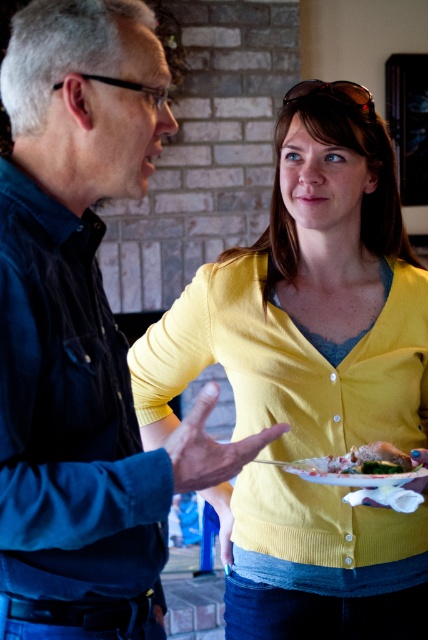
Question: Does matte black shirt at left appear on the right side of shiny silver plate at center?

Choices:
 (A) no
 (B) yes

Answer: (A)

Question: Is yellow knit cardigan at center bigger than shiny silver plate at center?

Choices:
 (A) no
 (B) yes

Answer: (B)

Question: Among these points, which one is nearest to the camera?

Choices:
 (A) (377, 444)
 (B) (3, 262)
 (C) (344, 106)

Answer: (B)

Question: Where is matte black shirt at left located in relation to shiny silver plate at center in the image?

Choices:
 (A) right
 (B) left

Answer: (B)

Question: Which object appears closest to the camera in this image?

Choices:
 (A) yellow knit cardigan at center
 (B) porcelain floral plate at center
 (C) shiny silver plate at center
 (D) matte black shirt at left

Answer: (D)

Question: Which point is closer to the camera taking this photo?

Choices:
 (A) (380, 465)
 (B) (409, 600)

Answer: (A)